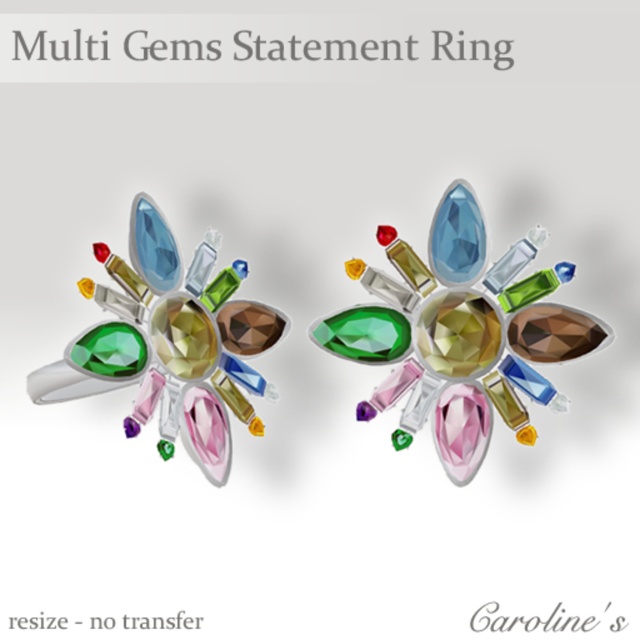
Is point (561, 308) more distant than point (193, 454)?

That is False.

Who is more forward, (451,317) or (189,419)?

Positioned in front is point (451,317).

Identify the location of multicolored gemstone ring at center. (456, 330).